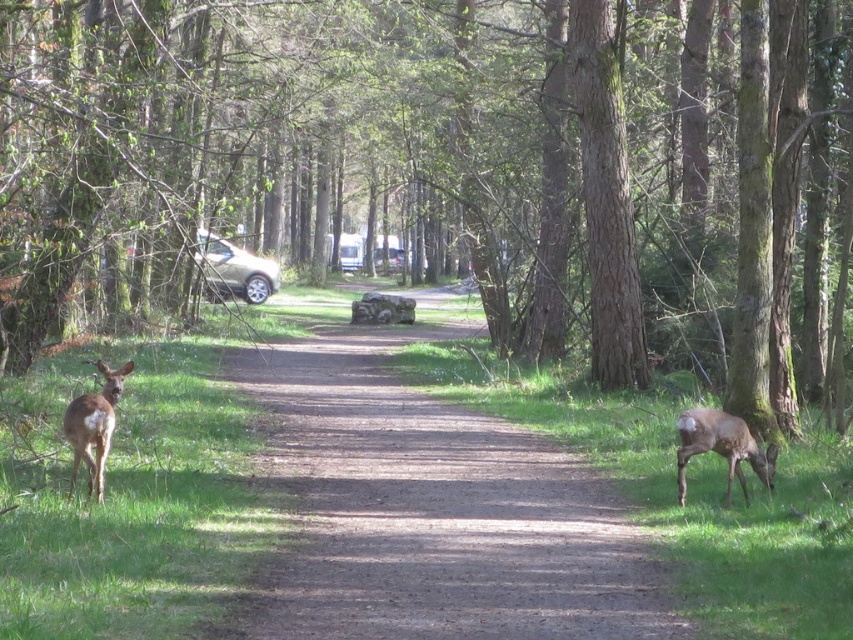
Question: Which of the following is the closest to the observer?

Choices:
 (A) (256, 291)
 (B) (680, 429)
 (C) (74, 268)

Answer: (B)

Question: Which point is closer to the camera?

Choices:
 (A) brown textured tree at center
 (B) brown furry deer at lower right
 (C) beige matte car at center

Answer: (A)

Question: Which point is farther from the camera taking this photo?

Choices:
 (A) (409, 227)
 (B) (114, 419)

Answer: (A)

Question: Does brown furry deer at left have a smaller size compared to beige matte car at center?

Choices:
 (A) yes
 (B) no

Answer: (A)

Question: Does brown textured tree at center appear over dirt path at center?

Choices:
 (A) yes
 (B) no

Answer: (A)

Question: Is brown furry deer at lower right closer to the viewer compared to brown furry deer at left?

Choices:
 (A) yes
 (B) no

Answer: (B)